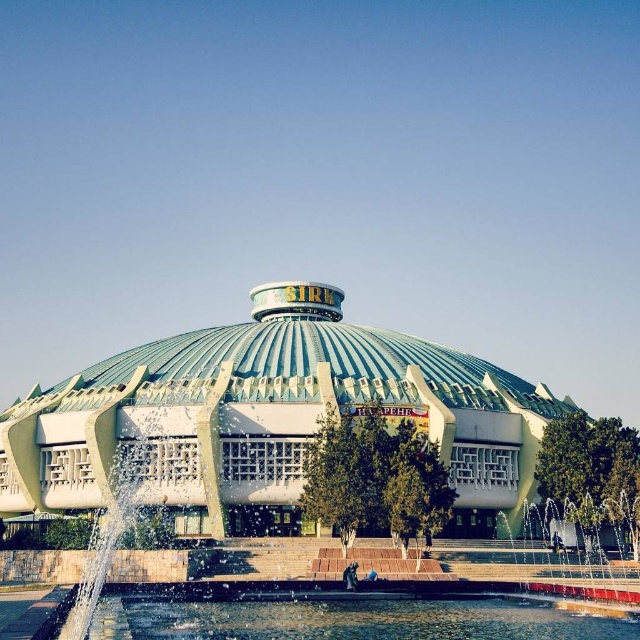
Question: Does green metallic dome at center appear over clear water at bottom?

Choices:
 (A) no
 (B) yes

Answer: (B)

Question: Among these objects, which one is farthest from the camera?

Choices:
 (A) clear water at bottom
 (B) green metallic dome at center

Answer: (B)

Question: Does green metallic dome at center appear on the right side of clear water at bottom?

Choices:
 (A) no
 (B) yes

Answer: (A)

Question: Is green metallic dome at center bigger than clear water at bottom?

Choices:
 (A) no
 (B) yes

Answer: (B)